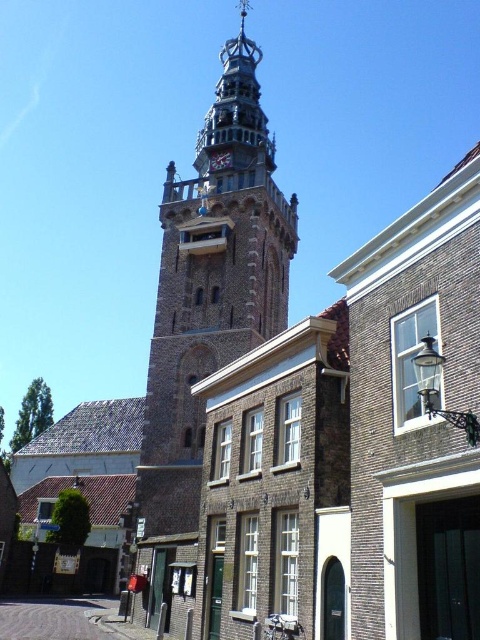
Describe the element at coordinates (207, 308) in the screenshot. I see `stone clock tower at center` at that location.

Which is in front, point (156, 508) or point (224, 156)?

Point (156, 508) is more forward.

This screenshot has height=640, width=480. Find the location of `stone clock tower at center`. stone clock tower at center is located at coordinates pos(207,308).